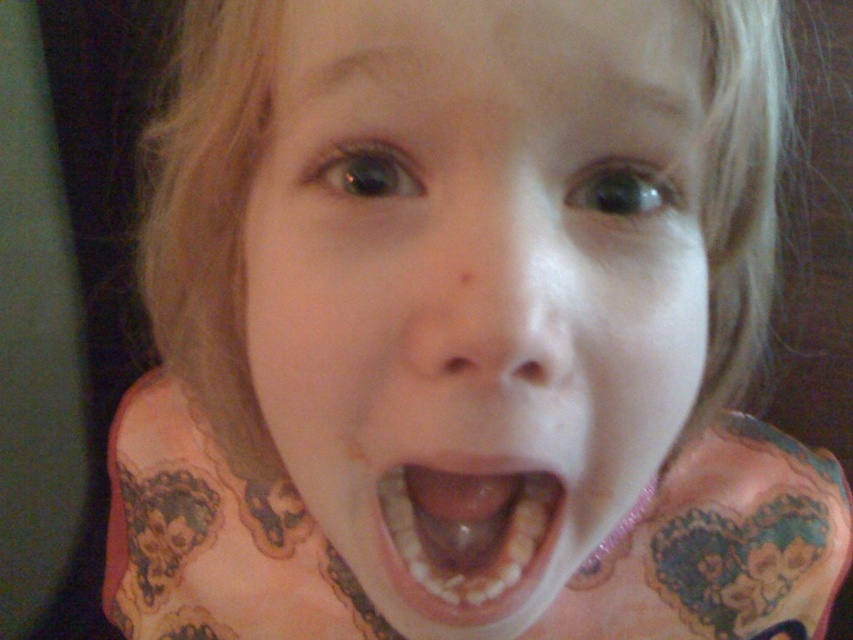
In the scene shown: You are a dentist examining a child. You notice the pale skin at center and the yellowish toothpaste at center in the image. Which one is located to the right of the other?

The pale skin at center is positioned on the right side of yellowish toothpaste at center.

You are a photographer adjusting the lighting for a portrait. You notice a point at coordinates (x=477, y=285). Where is this point located in relation to the child?

The point at (x=477, y=285) is located on the pale skin at center, so the photographer should ensure proper lighting there to highlight the child.

The child in the image has a pale skin at center and a yellowish toothpaste at center. Which one is positioned higher?

The pale skin at center is located above the yellowish toothpaste at center.